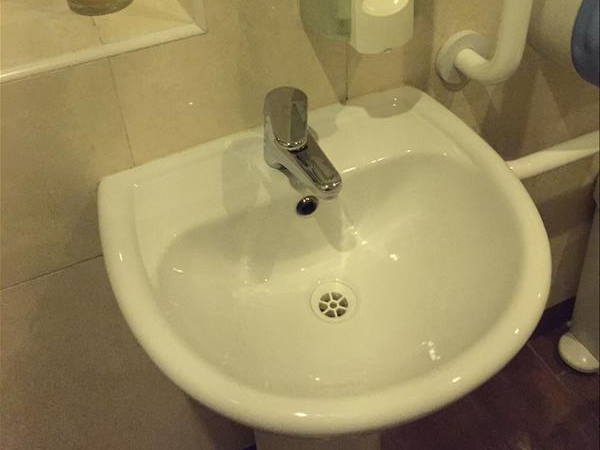
Where is `porcelain`? Image resolution: width=600 pixels, height=450 pixels. porcelain is located at coordinates (255, 245).